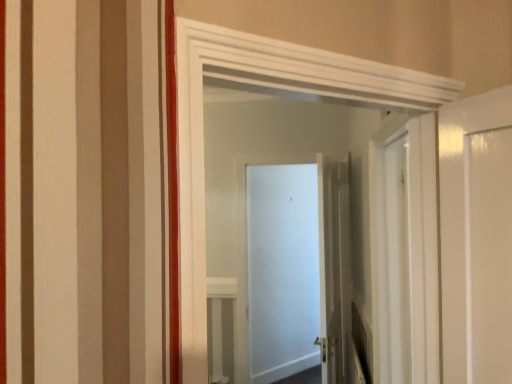
Question: Is white glossy door at center, the 2th door from the back, a part of white matte door at center, arranged as the third door when viewed from the front?

Choices:
 (A) no
 (B) yes

Answer: (A)

Question: Is white matte door at center, the 1th door from the back, wider than white glossy door at center, which ranks as the second door in front-to-back order?

Choices:
 (A) yes
 (B) no

Answer: (B)

Question: Is white matte door at center, the 1th door from the back, not inside white glossy door at center, the 2th door from the back?

Choices:
 (A) no
 (B) yes

Answer: (B)

Question: Is white matte door at center, the 1th door from the back, to the right of white glossy door at center, which ranks as the second door in front-to-back order, from the viewer's perspective?

Choices:
 (A) no
 (B) yes

Answer: (A)

Question: Is white matte door at center, arranged as the third door when viewed from the front, in front of white glossy door at center, which ranks as the second door in front-to-back order?

Choices:
 (A) no
 (B) yes

Answer: (A)

Question: Does white matte door at center, arranged as the third door when viewed from the front, come behind white glossy door at center, which ranks as the second door in front-to-back order?

Choices:
 (A) no
 (B) yes

Answer: (B)

Question: Are white glossy door at center, the first door positioned from the front, and white matte door at center, the 1th door from the back, far apart?

Choices:
 (A) yes
 (B) no

Answer: (A)

Question: Can you confirm if white glossy door at center, which appears as the 3th door when viewed from the back, is positioned to the right of white matte door at center, arranged as the third door when viewed from the front?

Choices:
 (A) yes
 (B) no

Answer: (B)

Question: Is white glossy door at center, the first door positioned from the front, outside of white matte door at center, arranged as the third door when viewed from the front?

Choices:
 (A) yes
 (B) no

Answer: (A)

Question: Does white glossy door at center, the first door positioned from the front, have a smaller size compared to white matte door at center, arranged as the third door when viewed from the front?

Choices:
 (A) yes
 (B) no

Answer: (B)

Question: From a real-world perspective, is white glossy door at center, which appears as the 3th door when viewed from the back, beneath white matte door at center, the 1th door from the back?

Choices:
 (A) no
 (B) yes

Answer: (A)

Question: Is white glossy door at center, the first door positioned from the front, closer to the viewer compared to white matte door at center, the 1th door from the back?

Choices:
 (A) no
 (B) yes

Answer: (B)

Question: Is white glossy door at center, which ranks as the second door in front-to-back order, positioned with its back to white glossy door at center, which appears as the 3th door when viewed from the back?

Choices:
 (A) no
 (B) yes

Answer: (A)